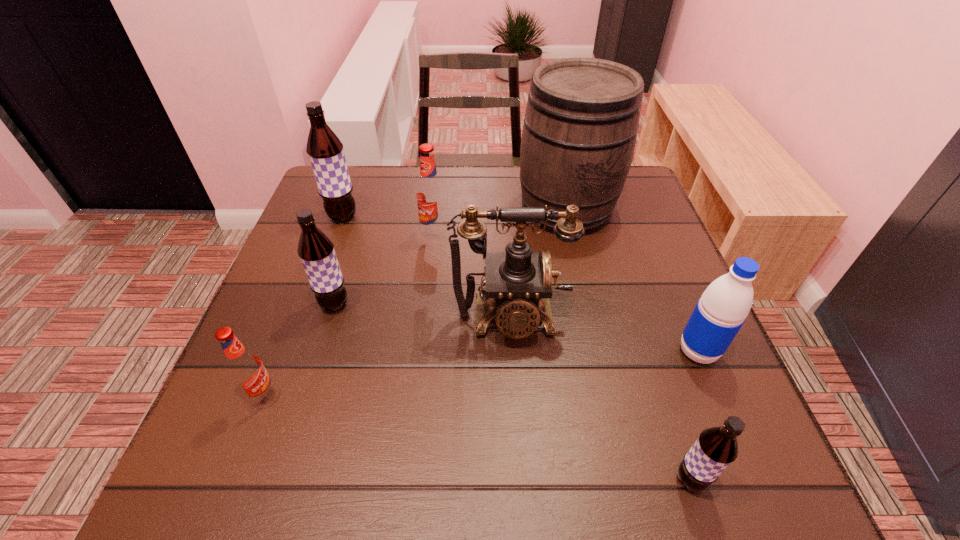
The height and width of the screenshot is (540, 960). Find the location of `wine bucket`. wine bucket is located at coordinates (581, 122).

Where is `the biggest brown root beer`? the biggest brown root beer is located at coordinates (325, 150).

I want to click on the farthest brown root beer, so 325,150.

Where is `telephone`? The height and width of the screenshot is (540, 960). telephone is located at coordinates (517, 283).

The height and width of the screenshot is (540, 960). I want to click on the farther red root beer, so click(430, 195).

The image size is (960, 540). What are the coordinates of `the fourth object from left to right` in the screenshot? It's located at (430, 195).

What are the coordinates of `the second smallest brown root beer` in the screenshot? It's located at (316, 250).

Locate an element on the screen. the third nearest root beer is located at coordinates (316, 250).

Locate an element on the screen. The height and width of the screenshot is (540, 960). water bottle is located at coordinates (722, 309).

Locate an element on the screen. blue water bottle is located at coordinates (722, 309).